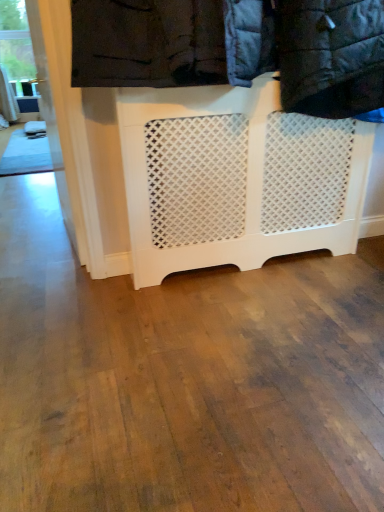
You are a GUI agent. You are given a task and a screenshot of the screen. Output one action in this format:
    pyautogui.click(x=<x>, y=<y>)
    Task: Click on the free point to the left of white lattice radiator at center
    
    Given the screenshot: What is the action you would take?
    pyautogui.click(x=105, y=312)